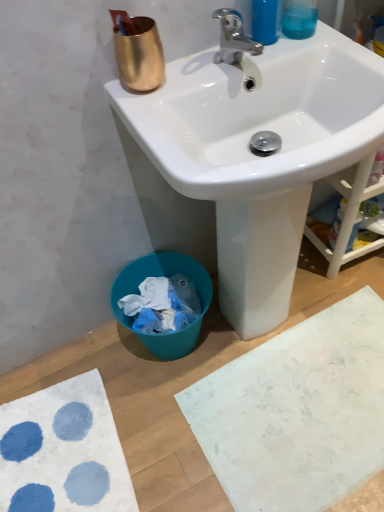
Question: Is chrome metallic faucet at upper center to the right of translucent blue liquid at upper right from the viewer's perspective?

Choices:
 (A) no
 (B) yes

Answer: (A)

Question: Does chrome metallic faucet at upper center turn towards translucent blue liquid at upper right?

Choices:
 (A) no
 (B) yes

Answer: (A)

Question: Is chrome metallic faucet at upper center far from translucent blue liquid at upper right?

Choices:
 (A) yes
 (B) no

Answer: (B)

Question: Is chrome metallic faucet at upper center further to the viewer compared to translucent blue liquid at upper right?

Choices:
 (A) no
 (B) yes

Answer: (A)

Question: Is chrome metallic faucet at upper center facing away from translucent blue liquid at upper right?

Choices:
 (A) no
 (B) yes

Answer: (A)

Question: Can you confirm if chrome metallic faucet at upper center is thinner than translucent blue liquid at upper right?

Choices:
 (A) yes
 (B) no

Answer: (B)

Question: Considering the relative sizes of translucent blue liquid at upper right and chrome metallic faucet at upper center in the image provided, is translucent blue liquid at upper right wider than chrome metallic faucet at upper center?

Choices:
 (A) no
 (B) yes

Answer: (A)

Question: Is translucent blue liquid at upper right taller than chrome metallic faucet at upper center?

Choices:
 (A) no
 (B) yes

Answer: (B)

Question: Is translucent blue liquid at upper right bigger than chrome metallic faucet at upper center?

Choices:
 (A) yes
 (B) no

Answer: (B)

Question: Is translucent blue liquid at upper right oriented away from chrome metallic faucet at upper center?

Choices:
 (A) no
 (B) yes

Answer: (A)

Question: Is translucent blue liquid at upper right to the right of chrome metallic faucet at upper center from the viewer's perspective?

Choices:
 (A) no
 (B) yes

Answer: (B)

Question: Would you consider translucent blue liquid at upper right to be distant from chrome metallic faucet at upper center?

Choices:
 (A) yes
 (B) no

Answer: (B)

Question: From a real-world perspective, is chrome metallic faucet at upper center over white textured bath mat at lower left, positioned as the second bath mat in right-to-left order?

Choices:
 (A) yes
 (B) no

Answer: (A)